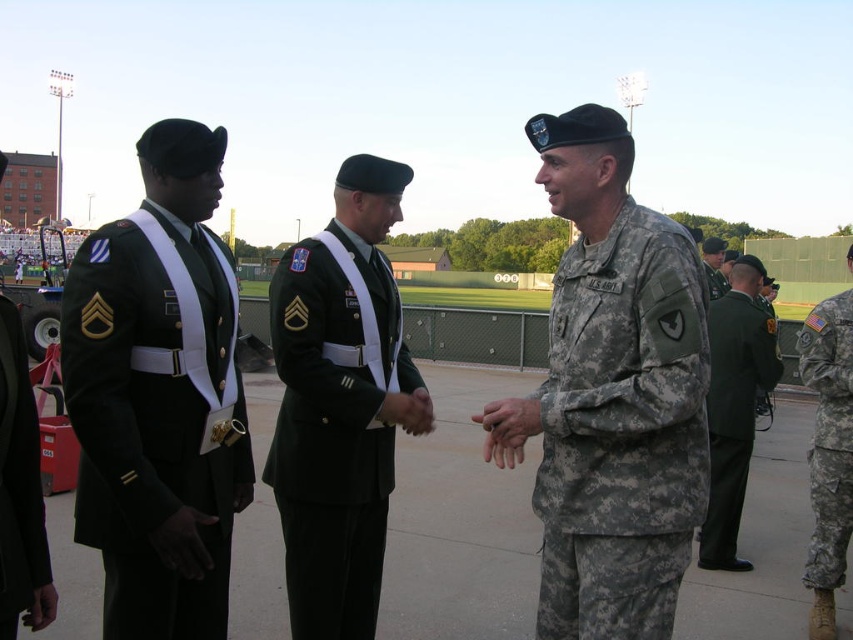
Question: Does camouflage fabric uniform at center appear on the left side of green uniform at right?

Choices:
 (A) no
 (B) yes

Answer: (B)

Question: Is green matte uniform at center wider than camouflage uniform at center?

Choices:
 (A) yes
 (B) no

Answer: (B)

Question: Among these objects, which one is nearest to the camera?

Choices:
 (A) camouflage fabric uniform at center
 (B) shiny black uniform at left
 (C) camouflage fabric uniform at right

Answer: (A)

Question: Which of these objects is positioned farthest from the green matte uniform at center?

Choices:
 (A) shiny black uniform at left
 (B) dark green fabric uniform at left
 (C) camouflage fabric uniform at center
 (D) green uniform at right

Answer: (D)

Question: Is camouflage fabric uniform at center wider than green matte uniform at center?

Choices:
 (A) yes
 (B) no

Answer: (B)

Question: Among these objects, which one is nearest to the camera?

Choices:
 (A) dark green fabric uniform at left
 (B) camouflage uniform at center

Answer: (A)